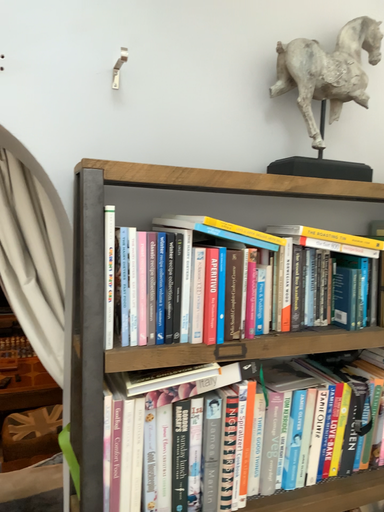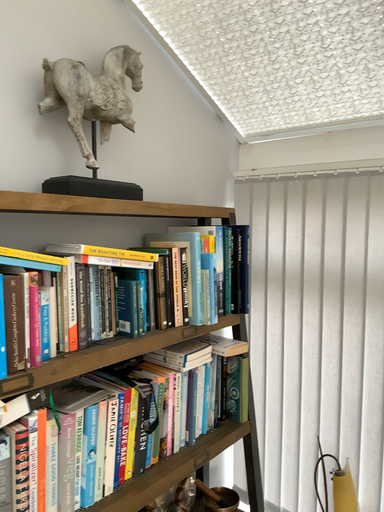
Question: Which way did the camera rotate in the video?

Choices:
 (A) rotated right
 (B) rotated left

Answer: (A)